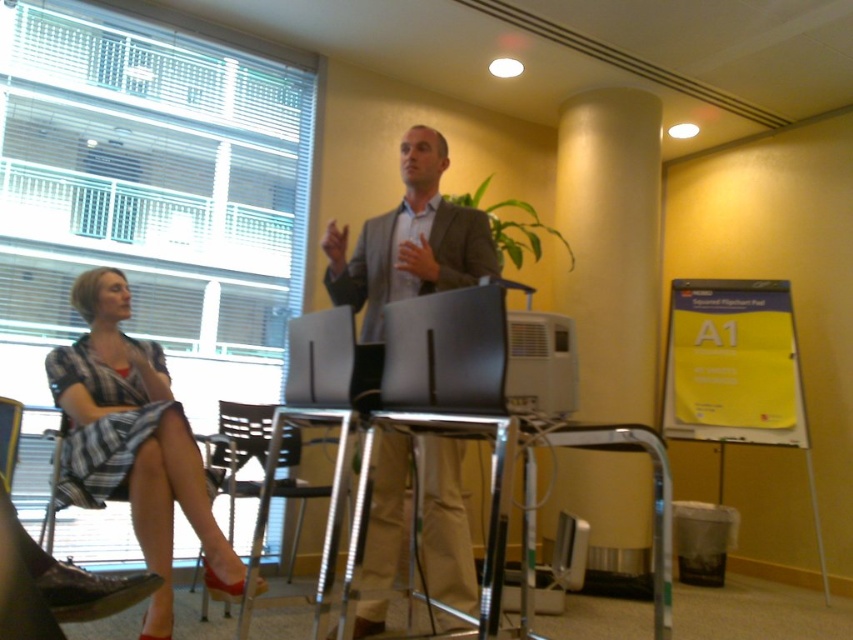
You are a person who wants to place a 15 cm tall book on the desk between the satin black laptop at center and the black plastic chair at lower left. Can the book fit vertically on the desk without falling off?

The satin black laptop at center is shorter than the black plastic chair at lower left, but this does not provide information about the desk space between them. The question cannot be answered with the given information.

You are a photographer in the conference room. You need to capture a clear photo of the matte black laptop at center without the matte gray suit at center blocking it. What adjustment should you make to your camera angle?

The matte gray suit at center is positioned over the matte black laptop at center. To avoid blocking the laptop, you should lower your camera angle to look underneath the suit.